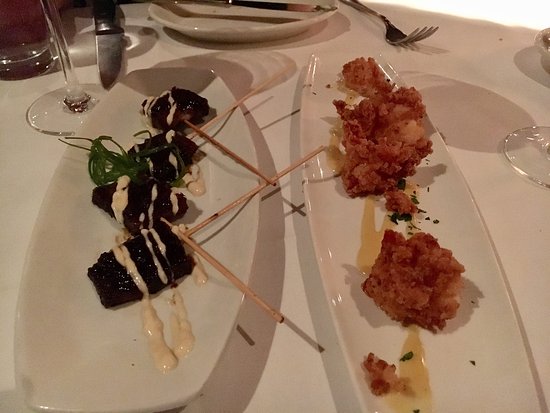
I want to click on white plate, so click(221, 25).